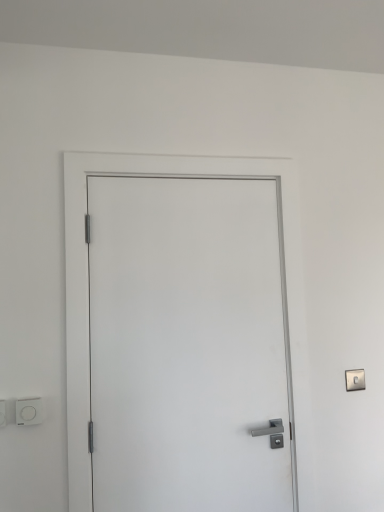
Question: Is white plastic light switch at lower left at the back of white matte door at center?

Choices:
 (A) yes
 (B) no

Answer: (B)

Question: Is white matte door at center to the right of white plastic light switch at lower left from the viewer's perspective?

Choices:
 (A) yes
 (B) no

Answer: (A)

Question: Does white matte door at center have a larger size compared to white plastic light switch at lower left?

Choices:
 (A) yes
 (B) no

Answer: (A)

Question: Can you confirm if white matte door at center is shorter than white plastic light switch at lower left?

Choices:
 (A) yes
 (B) no

Answer: (B)

Question: From the image's perspective, is white matte door at center below white plastic light switch at lower left?

Choices:
 (A) yes
 (B) no

Answer: (B)

Question: From a real-world perspective, does white matte door at center stand above white plastic light switch at lower left?

Choices:
 (A) no
 (B) yes

Answer: (B)

Question: Considering the relative positions of white plastic light switch at lower left and white matte door at center in the image provided, is white plastic light switch at lower left to the right of white matte door at center from the viewer's perspective?

Choices:
 (A) no
 (B) yes

Answer: (A)

Question: From the image's perspective, is white plastic light switch at lower left on white matte door at center?

Choices:
 (A) no
 (B) yes

Answer: (A)

Question: From a real-world perspective, is white plastic light switch at lower left located beneath white matte door at center?

Choices:
 (A) yes
 (B) no

Answer: (A)

Question: Considering the relative positions of white plastic light switch at lower left and white matte door at center in the image provided, is white plastic light switch at lower left behind white matte door at center?

Choices:
 (A) yes
 (B) no

Answer: (A)

Question: Does white plastic light switch at lower left contain white matte door at center?

Choices:
 (A) yes
 (B) no

Answer: (B)

Question: Can you confirm if white plastic light switch at lower left is shorter than white matte door at center?

Choices:
 (A) no
 (B) yes

Answer: (B)

Question: Would you say white plastic light switch at lower left is to the left or to the right of white matte door at center in the picture?

Choices:
 (A) left
 (B) right

Answer: (A)